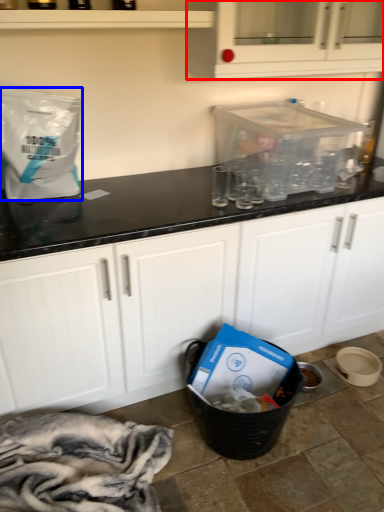
Question: Which object appears closest to the camera in this image, cabinetry (highlighted by a red box) or paper bag (highlighted by a blue box)?

Choices:
 (A) cabinetry
 (B) paper bag

Answer: (B)